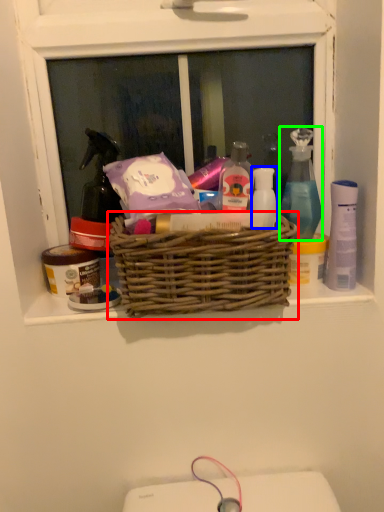
Question: Estimate the real-world distances between objects in this image. Which object is farther from picnic basket (highlighted by a red box), toiletry (highlighted by a blue box) or cleaning product (highlighted by a green box)?

Choices:
 (A) toiletry
 (B) cleaning product

Answer: (B)